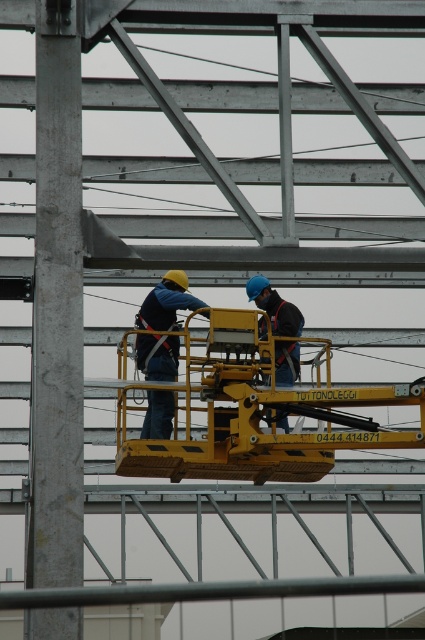
Question: Is matte blue safety vest at center above blue hard hat at center?

Choices:
 (A) yes
 (B) no

Answer: (B)

Question: Can you confirm if yellow metallic lift at center is bigger than blue hard hat at center?

Choices:
 (A) no
 (B) yes

Answer: (A)

Question: Does yellow metallic lift at center appear on the right side of blue hard hat at center?

Choices:
 (A) no
 (B) yes

Answer: (B)

Question: Among these points, which one is farthest from the camera?

Choices:
 (A) (331, 404)
 (B) (295, 349)

Answer: (B)

Question: Which of the following is the farthest from the observer?

Choices:
 (A) blue hard hat at center
 (B) yellow metallic lift at center

Answer: (B)

Question: Which is farther from the matte blue safety vest at center?

Choices:
 (A) blue hard hat at center
 (B) yellow metallic lift at center

Answer: (B)